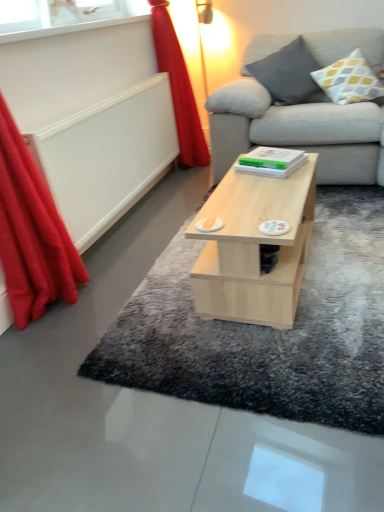
Where is `free location to the right of light wood coffee table at center`? The image size is (384, 512). free location to the right of light wood coffee table at center is located at coordinates (356, 244).